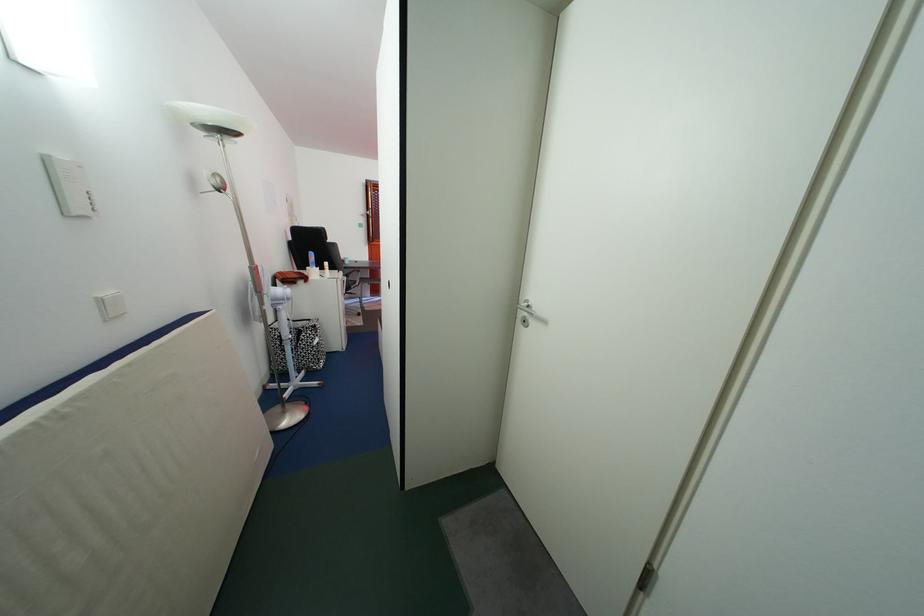
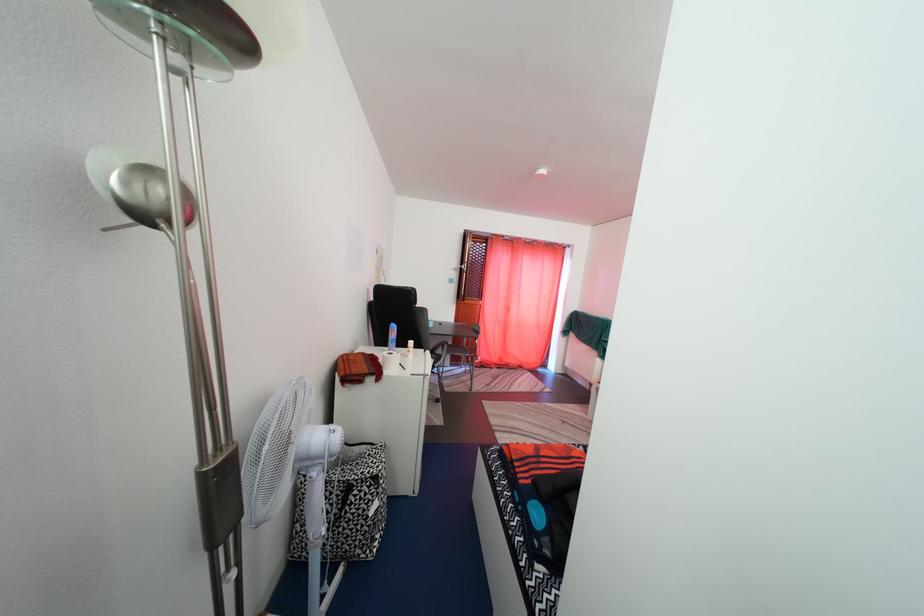
In the second image, find the point that corresponds to point (377, 216) in the first image.

(470, 270)